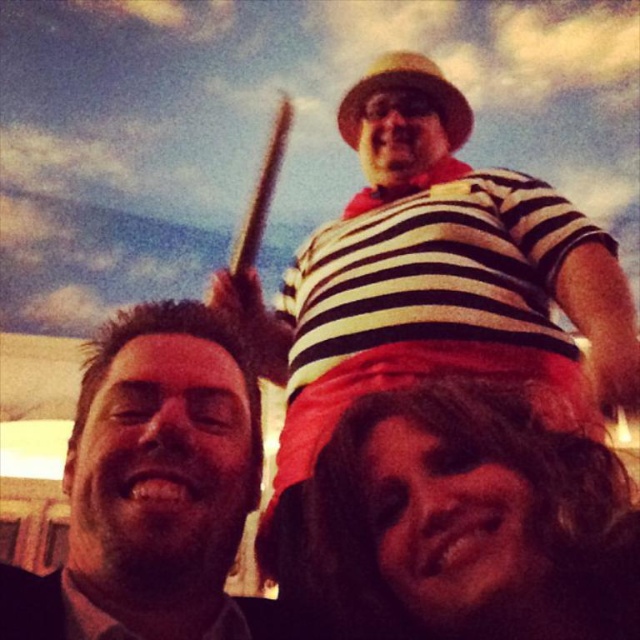
You are a photographer trying to adjust the focus of your camera. The striped cotton shirt at upper center is part of the scene. Can you focus on it clearly if your camera has a maximum focus distance of 10 feet?

The striped cotton shirt at upper center is 9.22 feet from the camera, which is within the maximum focus distance of 10 feet. Therefore, the camera can focus on it clearly.

You are trying to identify the positions of two people in the photo. The first person has dark curly hair at lower center and the second has dark brown hair at left. Based on the description, which person is positioned more to the right side of the image?

The dark curly hair at lower center is positioned more to the right side of the image compared to the dark brown hair at left.